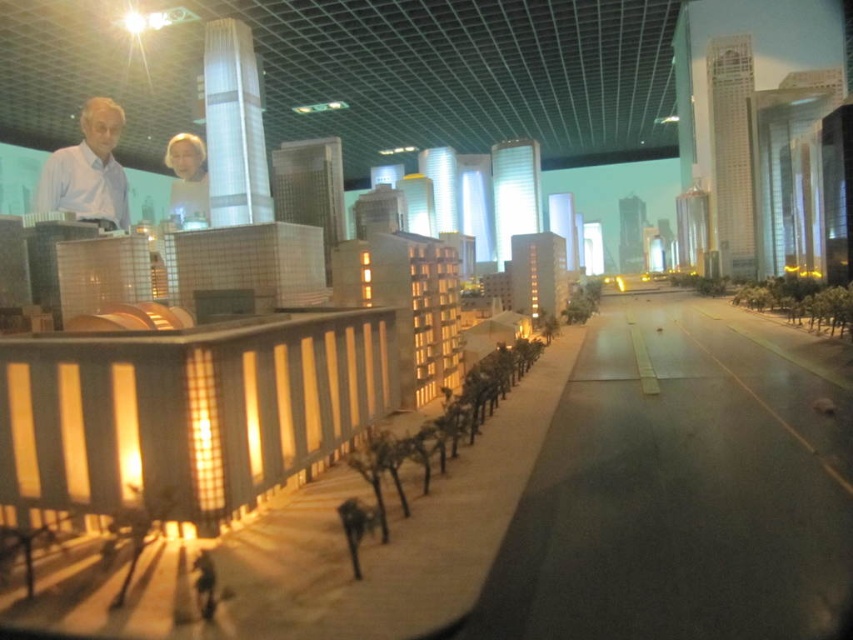
Which is below, white shirt at left or matte white man at upper center?

white shirt at left

Measure the distance between white shirt at left and camera.

white shirt at left is 21.50 feet away from camera.

Locate an element on the screen. white shirt at left is located at coordinates (88, 170).